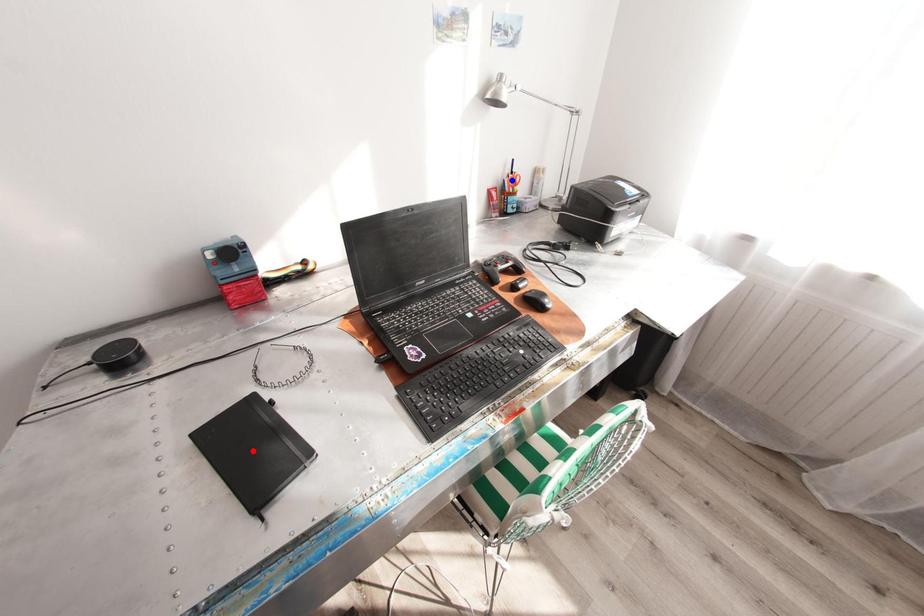
Question: In the image, two points are highlighted. Which point is nearer to the camera? Reply with the corresponding letter.

Choices:
 (A) blue point
 (B) red point

Answer: (B)